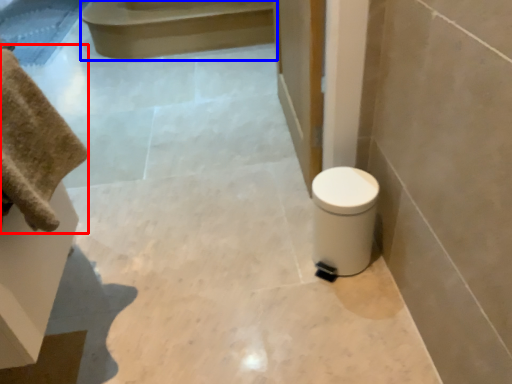
Question: Among these objects, which one is nearest to the camera, bath towel (highlighted by a red box) or stair (highlighted by a blue box)?

Choices:
 (A) bath towel
 (B) stair

Answer: (A)